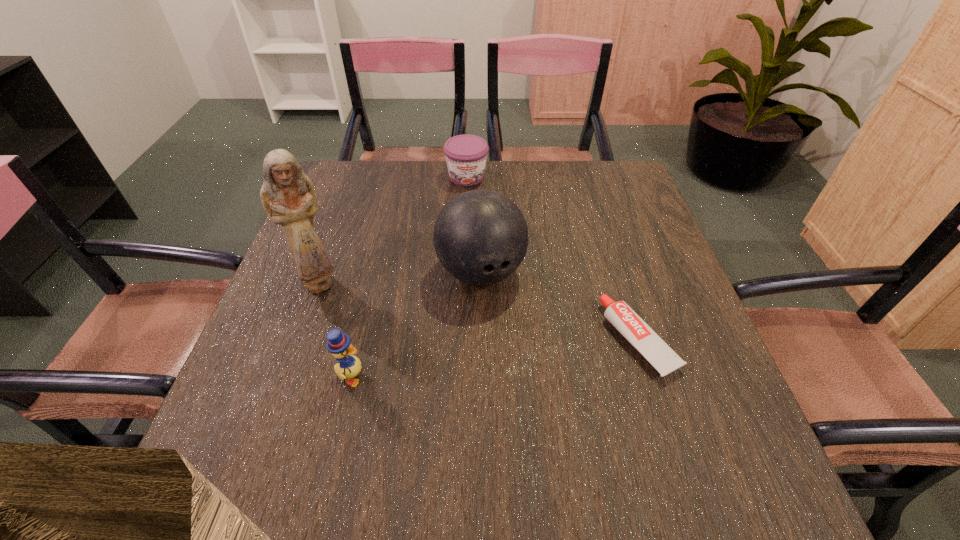
Identify the location of the third closest object to the leftmost object. (466, 155).

The width and height of the screenshot is (960, 540). What are the coordinates of `free space that satisfies the following two spatial constraints: 1. on the front side of the leftmost object; 2. on the face of the fourth object from right to left, where the monocle is placed` in the screenshot? It's located at (285, 377).

This screenshot has height=540, width=960. What are the coordinates of `vacant space that satisfies the following two spatial constraints: 1. on the back side of the leftmost object; 2. on the right side of the second shortest object` in the screenshot? It's located at (357, 177).